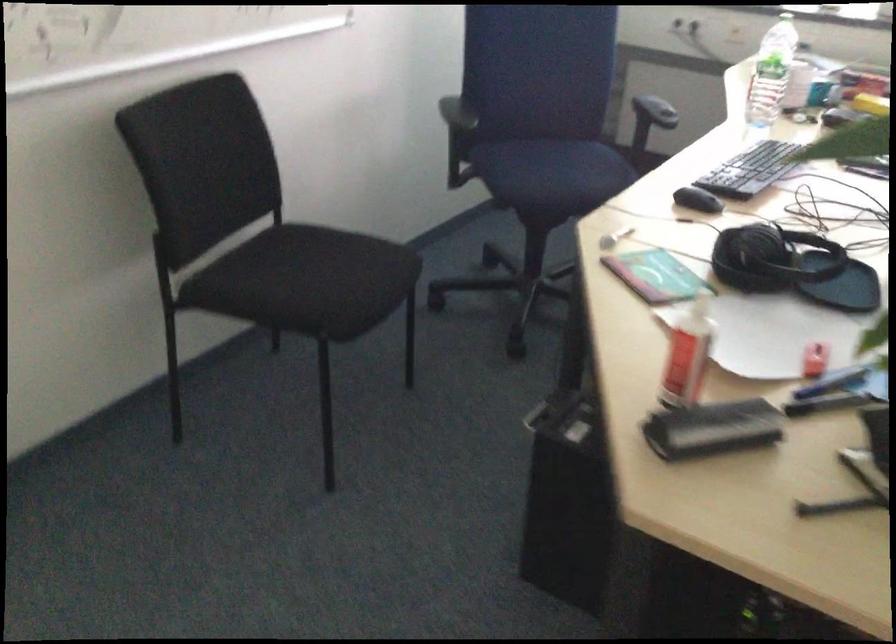
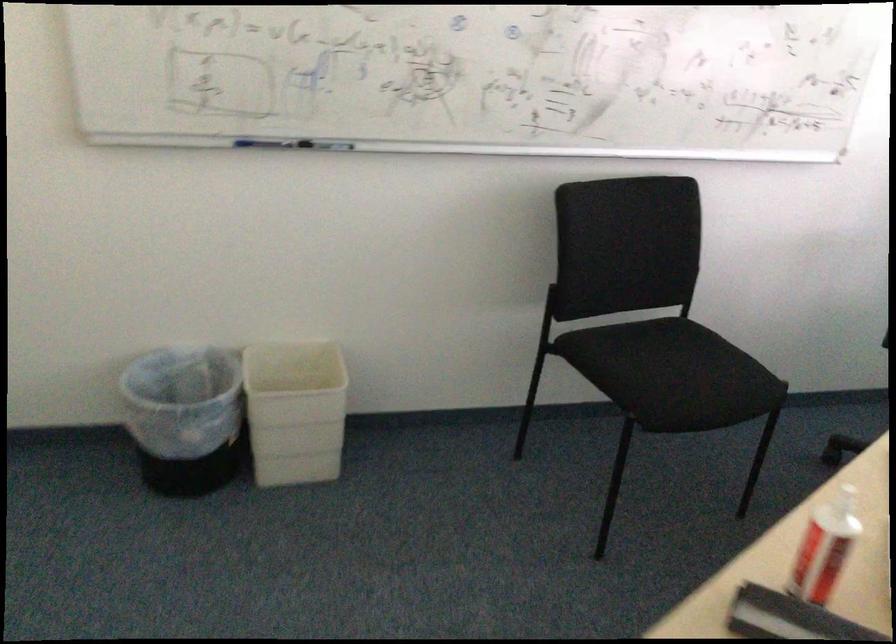
In the second image, find the point that corresponds to (x=659, y=334) in the first image.

(824, 547)